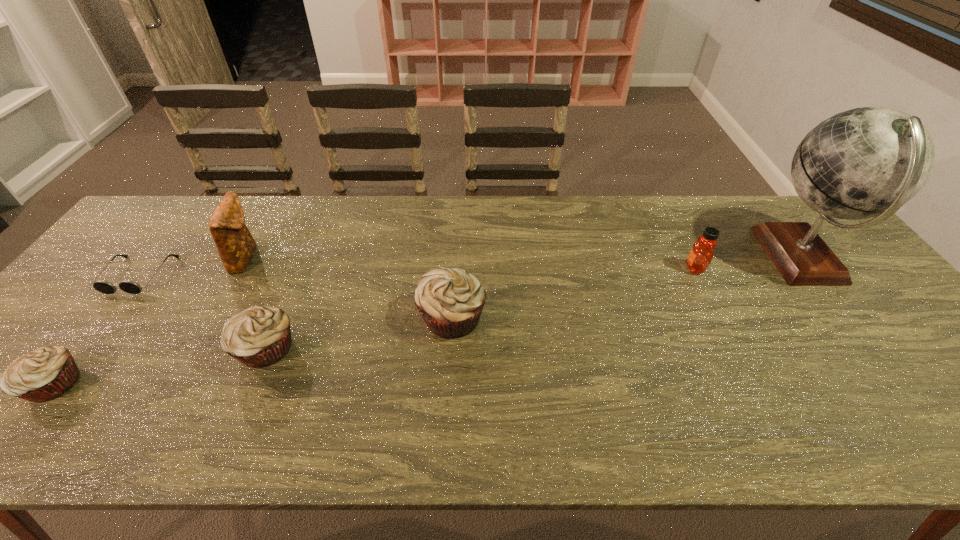
The width and height of the screenshot is (960, 540). In order to click on the third object from left to right in this screenshot , I will do `click(236, 246)`.

Locate an element on the screen. This screenshot has height=540, width=960. vacant space located on the right of the shortest muffin is located at coordinates (122, 384).

Identify the location of free space located 0.220m on the left of the second tallest muffin. This screenshot has width=960, height=540. (142, 349).

This screenshot has width=960, height=540. Find the location of `vacant space located 0.250m on the left of the rightmost muffin`. vacant space located 0.250m on the left of the rightmost muffin is located at coordinates (319, 318).

The height and width of the screenshot is (540, 960). Find the location of `free space located on the front label of the sixth object from left to right`. free space located on the front label of the sixth object from left to right is located at coordinates (660, 268).

Identify the location of vacant space located on the front label of the sixth object from left to right. (610, 268).

This screenshot has width=960, height=540. Find the location of `vacant area located 0.330m on the front label of the sixth object from left to right`. vacant area located 0.330m on the front label of the sixth object from left to right is located at coordinates (567, 268).

This screenshot has width=960, height=540. What are the coordinates of `vacant space situated 0.220m on the front-facing side of the shortest object` in the screenshot? It's located at (68, 366).

You are a GUI agent. You are given a task and a screenshot of the screen. Output one action in this format:
    pyautogui.click(x=<x>, y=<y>)
    Task: Click on the vacant position located at the equator of the rightmost object
    
    Given the screenshot: What is the action you would take?
    pyautogui.click(x=660, y=258)

This screenshot has width=960, height=540. I want to click on free spot located at the equator of the rightmost object, so click(657, 258).